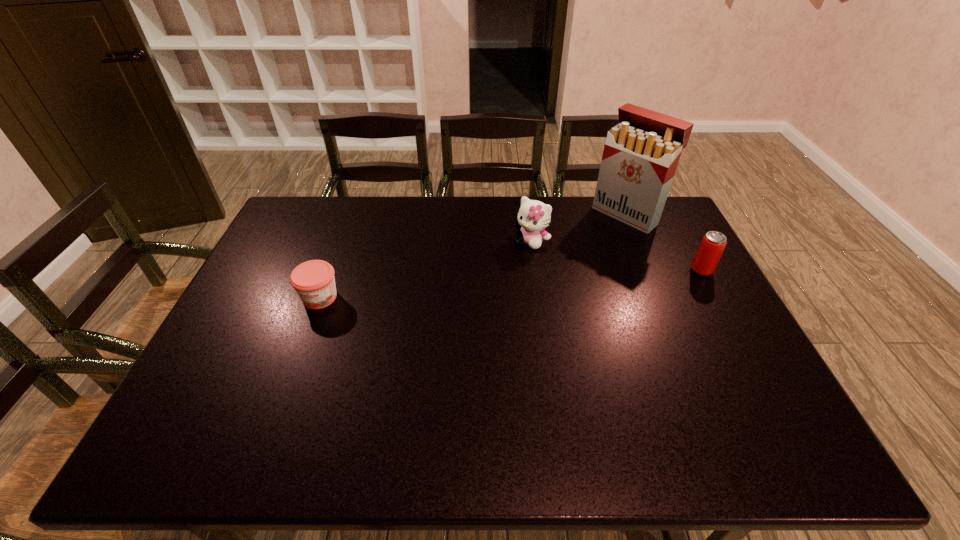
At what (x,y) coordinates should I click in order to perform the action: click on object that is at the far right corner. Please return your answer as a coordinate pair (x, y). This screenshot has width=960, height=540. Looking at the image, I should click on (641, 154).

In the image, there is a desktop. Identify the location of free region at the far edge. Image resolution: width=960 pixels, height=540 pixels. pos(494,218).

In the image, there is a desktop. At what (x,y) coordinates should I click in order to perform the action: click on vacant region at the left edge. Please return your answer as a coordinate pair (x, y). This screenshot has width=960, height=540. Looking at the image, I should click on (251, 350).

Where is `vacant space at the near left corner of the desktop`? The height and width of the screenshot is (540, 960). vacant space at the near left corner of the desktop is located at coordinates (207, 382).

Locate an element on the screen. The height and width of the screenshot is (540, 960). free space at the far right corner is located at coordinates (661, 229).

At what (x,y) coordinates should I click in order to perform the action: click on vacant area between the tallest object and the third shortest object. Please return your answer as a coordinate pair (x, y). The height and width of the screenshot is (540, 960). Looking at the image, I should click on (579, 227).

Locate an element on the screen. free area in between the third object from right to left and the nearest object is located at coordinates (425, 269).

Locate an element on the screen. The width and height of the screenshot is (960, 540). free point between the beer can and the second object from right to left is located at coordinates coord(663,242).

Locate an element on the screen. free space between the nearest object and the second object from right to left is located at coordinates (473, 256).

You are a GUI agent. You are given a task and a screenshot of the screen. Output one action in this format:
    pyautogui.click(x=<x>, y=<y>)
    Task: Click on the free area in between the cigarette case and the second shortest object
    The width and height of the screenshot is (960, 540).
    Given the screenshot: What is the action you would take?
    pyautogui.click(x=663, y=242)